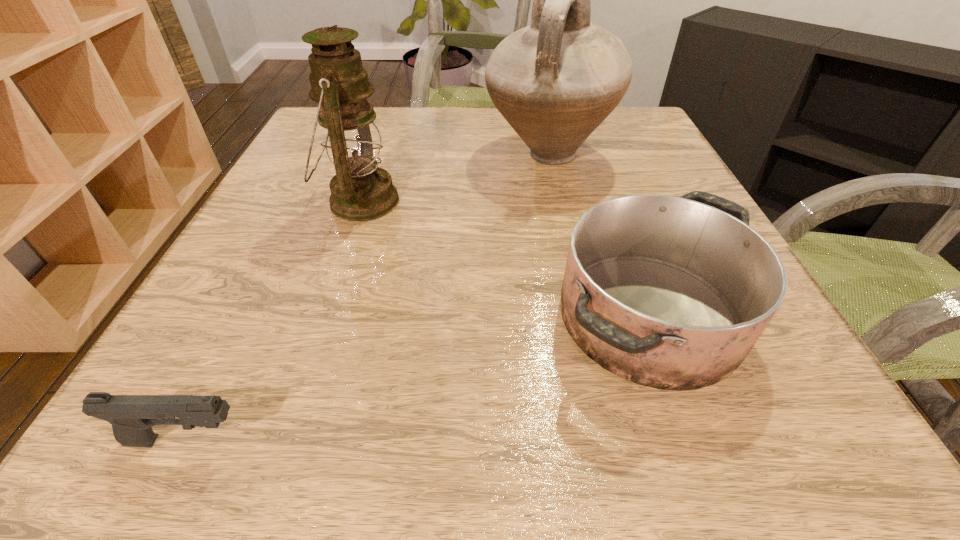
Locate an element on the screen. The height and width of the screenshot is (540, 960). vacant space at the far edge is located at coordinates (487, 120).

Identify the location of free spot at the near edge of the desktop. The height and width of the screenshot is (540, 960). (436, 440).

At what (x,y) coordinates should I click in order to perform the action: click on vacant space at the left edge of the desktop. Please return your answer as a coordinate pair (x, y). Looking at the image, I should click on (276, 245).

The image size is (960, 540). I want to click on vacant space at the right edge, so click(x=606, y=169).

In the image, there is a desktop. Where is `vacant area at the near left corner`? vacant area at the near left corner is located at coordinates (114, 446).

Identify the location of vacant space at the far right corner. (640, 127).

The width and height of the screenshot is (960, 540). Identify the location of free space between the oil lamp and the nearest object. (274, 321).

Locate an element on the screen. This screenshot has height=540, width=960. empty space between the nearest object and the second nearest object is located at coordinates (418, 379).

This screenshot has width=960, height=540. I want to click on blank region between the oil lamp and the shortest object, so click(x=274, y=321).

This screenshot has width=960, height=540. I want to click on free spot between the oil lamp and the nearest object, so click(x=274, y=321).